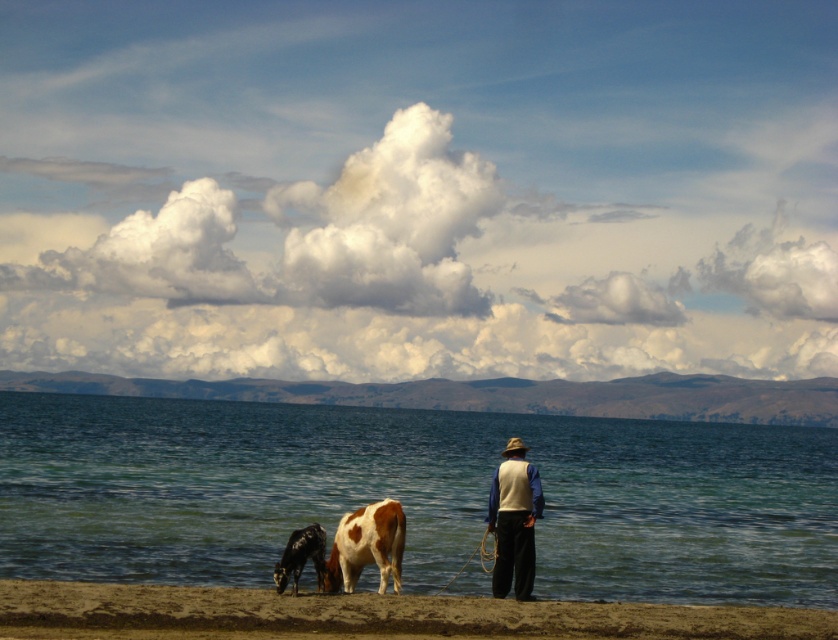
You are a hiker who wants to take a photo of the light beige vest at center and the brown speckled hide at lower center. Which object should you zoom in on more to ensure both are clearly visible in the photo?

The light beige vest at center is smaller than the brown speckled hide at lower center, so you should zoom in more on the light beige vest at center to ensure it appears large enough in the photo while keeping the brown speckled hide at lower center in frame.

You are a photographer standing at the lakeside and want to capture both the clear blue water at lower center and the black glossy cow at lower left in the same frame. Considering their sizes, which object will appear bigger in your photo?

The clear blue water at lower center will appear bigger in the photo because it has a larger size compared to the black glossy cow at lower left.

You are standing at the point labeled point (x=414, y=496) in the image. What can you see directly in front of you?

The point labeled point (x=414, y=496) indicates clear blue water at lower center, so directly in front of you would be the clear blue water at lower center.